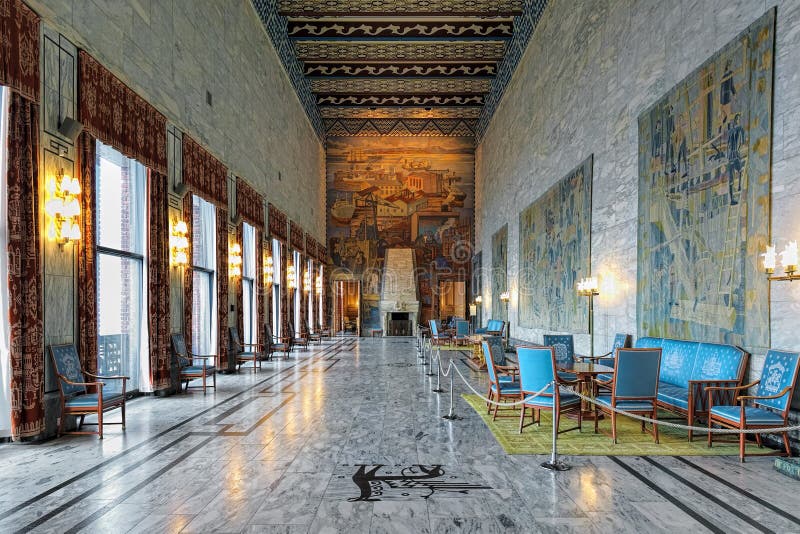
This screenshot has height=534, width=800. In order to click on white tile with grey veining in this screenshot , I will do 254,474, 370,379.